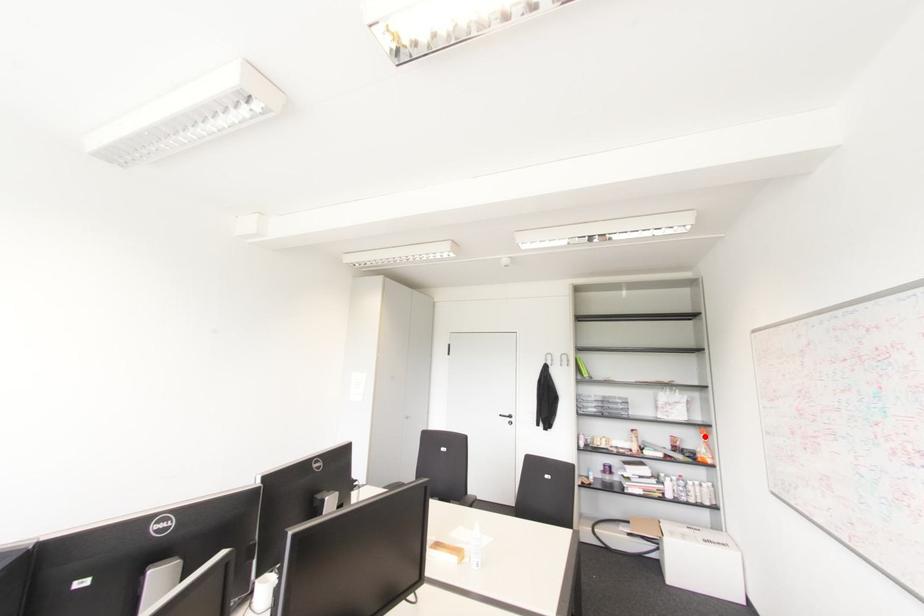
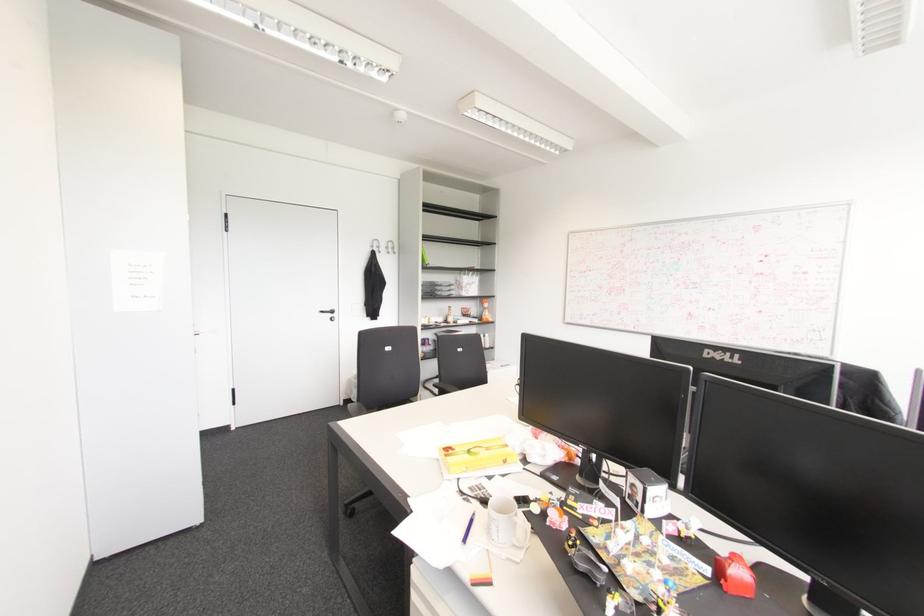
Locate, in the second image, the point that corresponds to the highlighted location in the first image.

(485, 305)